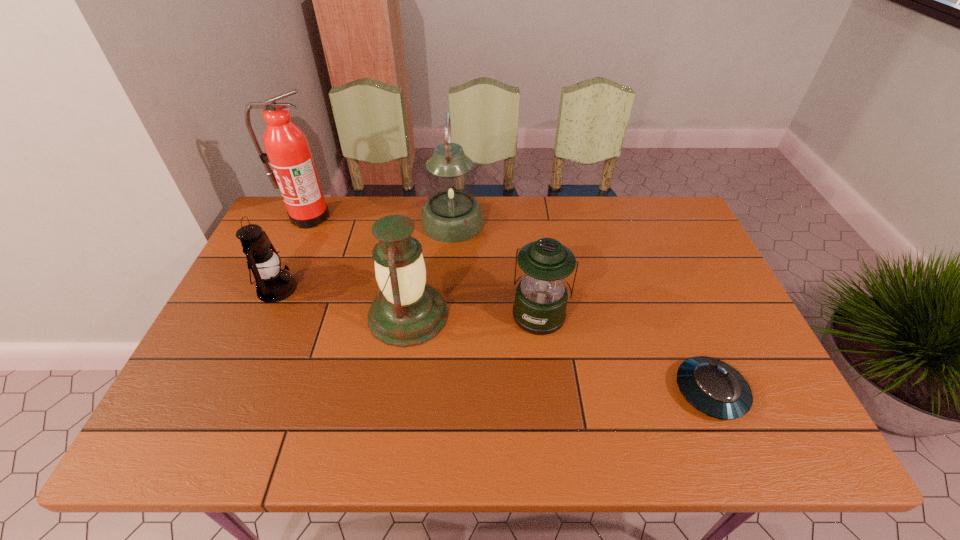
Find the location of `blank region between the tallest object and the nearest object`. blank region between the tallest object and the nearest object is located at coordinates [509, 304].

Locate an element on the screen. Image resolution: width=960 pixels, height=540 pixels. unoccupied area between the tallest object and the leftmost lantern is located at coordinates (293, 253).

Identify the location of free space between the leftmost lantern and the nearest object. (493, 340).

Where is `vacant area that lies between the third tallest object and the rightmost lantern`? This screenshot has height=540, width=960. vacant area that lies between the third tallest object and the rightmost lantern is located at coordinates (474, 314).

In order to click on vacant region between the second tallest lantern and the leftmost lantern in this screenshot , I will do `click(343, 301)`.

Identify the location of vacant area that lies between the farthest lantern and the rightmost lantern. This screenshot has width=960, height=540. (496, 268).

Identify which object is the fifth nearest to the second tallest lantern. Please provide its 2D coordinates. Your answer should be formatted as a tuple, i.e. [(x, y)], where the tuple contains the x and y coordinates of a point satisfying the conditions above.

[(713, 387)]

Point out which object is positioned as the fourth nearest to the rightmost lantern. Please provide its 2D coordinates. Your answer should be formatted as a tuple, i.e. [(x, y)], where the tuple contains the x and y coordinates of a point satisfying the conditions above.

[(273, 284)]

Identify the location of the closest lantern to the tallest lantern. Image resolution: width=960 pixels, height=540 pixels. (407, 312).

Identify the location of the closest lantern to the fourth shortest object. (541, 297).